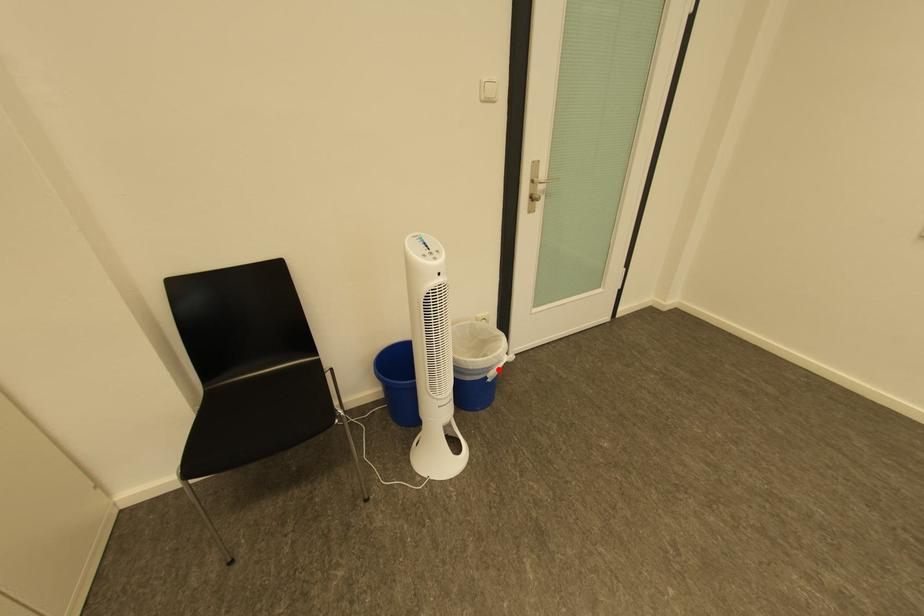
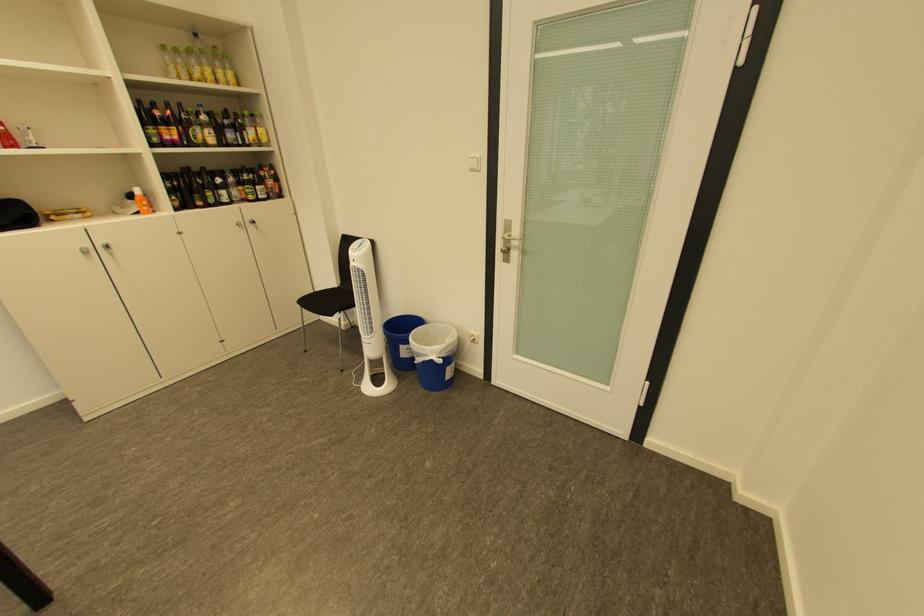
The point at the highlighted location is marked in the first image. Where is the corresponding point in the second image?

(429, 355)